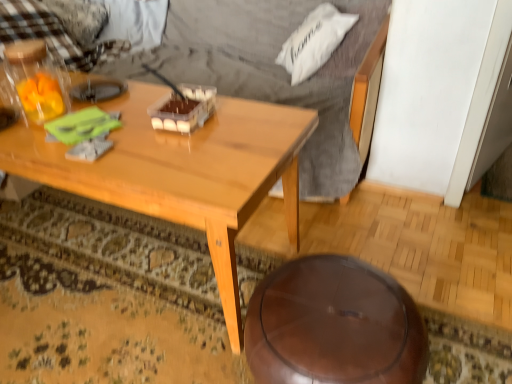
Where is `vacant point above light brown wood coffee table at center (from a real-world perspective)`? The width and height of the screenshot is (512, 384). vacant point above light brown wood coffee table at center (from a real-world perspective) is located at coordinates (136, 122).